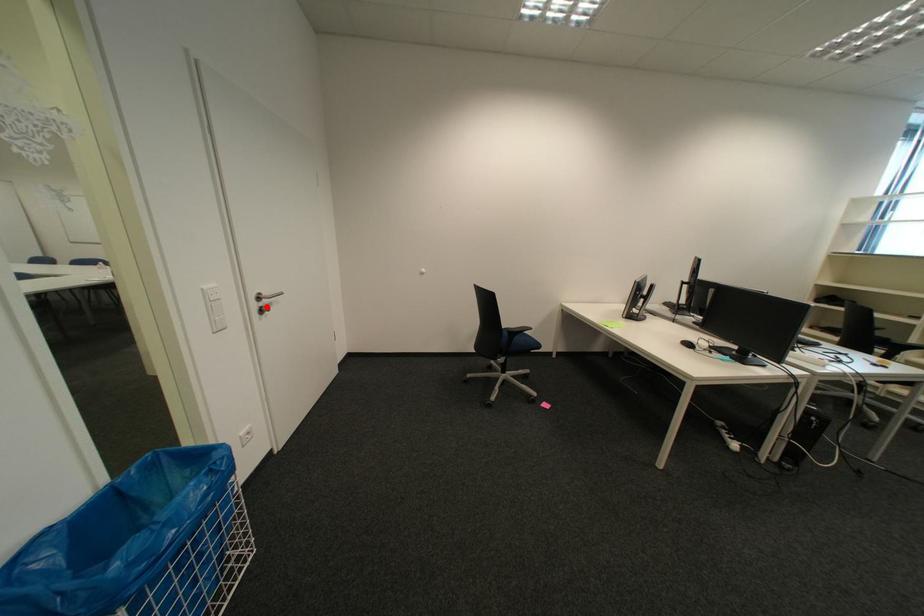
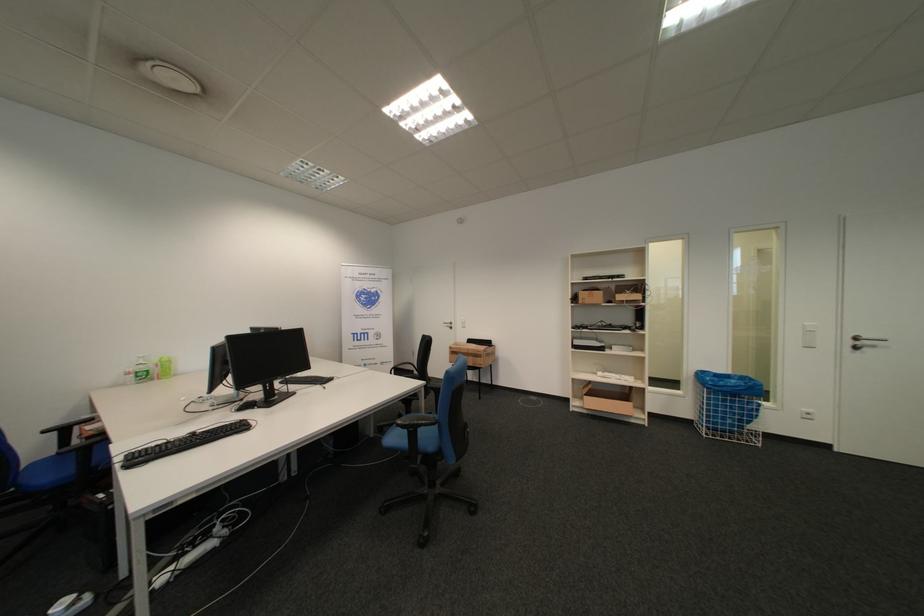
In the second image, find the point that corresponds to the highlighted location in the first image.

(862, 344)